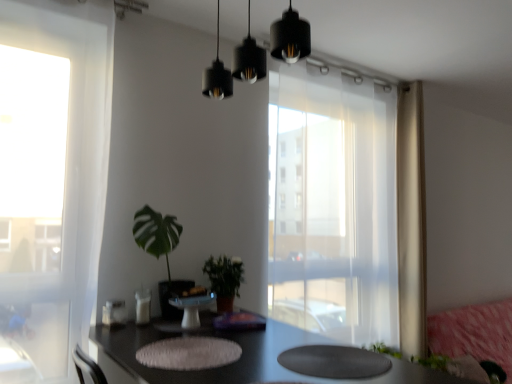
The height and width of the screenshot is (384, 512). Describe the element at coordinates (474, 333) in the screenshot. I see `pink fabric couch at lower right` at that location.

What do you see at coordinates (411, 220) in the screenshot? I see `beige sheer curtain at right` at bounding box center [411, 220].

What do you see at coordinates (333, 205) in the screenshot? The image size is (512, 384). I see `transparent curtain at center` at bounding box center [333, 205].

What do you see at coordinates (161, 252) in the screenshot?
I see `green leafy plant at center, positioned as the 1th houseplant in left-to-right order` at bounding box center [161, 252].

At what (x,y) coordinates should I click in order to perform the action: click on pink fabric couch at lower right. Please return your answer as a coordinate pair (x, y). Looking at the image, I should click on (474, 333).

Is pink fabric couch at lower right positioned with its back to transparent curtain at center?

No, pink fabric couch at lower right is not facing the opposite direction of transparent curtain at center.

Is point (458, 345) closer or farther from the camera than point (364, 277)?

Point (458, 345) is farther from the camera than point (364, 277).

From the image's perspective, is pink fabric couch at lower right located above transparent curtain at center?

No, from the image's perspective, pink fabric couch at lower right is not over transparent curtain at center.

Does green leafy plant at center, positioned as the second houseplant in right-to-left order, turn towards transparent curtain at center?

No, green leafy plant at center, positioned as the second houseplant in right-to-left order, is not oriented towards transparent curtain at center.

Is green leafy plant at center, positioned as the second houseplant in right-to-left order, to the left or to the right of transparent curtain at center in the image?

green leafy plant at center, positioned as the second houseplant in right-to-left order, is to the left of transparent curtain at center.

You are a GUI agent. You are given a task and a screenshot of the screen. Output one action in this format:
    pyautogui.click(x=<x>, y=<y>)
    Task: Click on the window behind the green leafy plant at center, positioned as the second houseplant in right-to-left order
    
    Given the screenshot: What is the action you would take?
    pyautogui.click(x=333, y=205)

Who is smaller, green leafy plant at center, positioned as the 1th houseplant in left-to-right order, or transparent curtain at center?

With smaller size is green leafy plant at center, positioned as the 1th houseplant in left-to-right order.

In the scene shown: Is green leafy plant at center, positioned as the 1th houseplant in left-to-right order, not close to black glossy table at center?

Actually, green leafy plant at center, positioned as the 1th houseplant in left-to-right order, and black glossy table at center are a little close together.

Where is `table to the right of green leafy plant at center, positioned as the 1th houseplant in left-to-right order`? table to the right of green leafy plant at center, positioned as the 1th houseplant in left-to-right order is located at coordinates (241, 356).

From the image's perspective, is green leafy plant at center, positioned as the 1th houseplant in left-to-right order, above or below black glossy table at center?

green leafy plant at center, positioned as the 1th houseplant in left-to-right order, is situated higher than black glossy table at center in the image.

Consider the image. Between green leafy plant at center, positioned as the second houseplant in right-to-left order, and black glossy table at center, which one appears on the left side from the viewer's perspective?

green leafy plant at center, positioned as the second houseplant in right-to-left order, is more to the left.

Between white glossy cake stand at center and green matte plant at center, the first houseplant viewed from the right, which one has less height?

white glossy cake stand at center.

Which is in front, white glossy cake stand at center or green matte plant at center, the first houseplant viewed from the right?

Positioned in front is white glossy cake stand at center.

From the image's perspective, would you say white glossy cake stand at center is shown under green matte plant at center, the first houseplant viewed from the right?

Correct, white glossy cake stand at center appears lower than green matte plant at center, the first houseplant viewed from the right, in the image.

From a real-world perspective, does white glossy cake stand at center stand above green matte plant at center, which is counted as the 2th houseplant, starting from the left?

Actually, white glossy cake stand at center is physically below green matte plant at center, which is counted as the 2th houseplant, starting from the left, in the real world.

Considering the positions of objects black glossy table at center and white glossy cake stand at center in the image provided, who is more to the left, black glossy table at center or white glossy cake stand at center?

From the viewer's perspective, white glossy cake stand at center appears more on the left side.

Is point (117, 338) closer or farther from the camera than point (203, 307)?

Point (117, 338) appears to be farther away from the viewer than point (203, 307).

Relative to white glossy cake stand at center, is black glossy table at center in front or behind?

black glossy table at center is positioned closer to the viewer than white glossy cake stand at center.

Who is smaller, black glossy table at center or white glossy cake stand at center?

Smaller between the two is white glossy cake stand at center.

Which object is positioned more to the right, black glossy table at center or green leafy plant at center, positioned as the 1th houseplant in left-to-right order?

Positioned to the right is black glossy table at center.

Which of these two, black glossy table at center or green leafy plant at center, positioned as the second houseplant in right-to-left order, stands taller?

With more height is green leafy plant at center, positioned as the second houseplant in right-to-left order.

From the black glossy table at center, count the 2nd houseplant to the left and point to it. Please provide its 2D coordinates.

[(161, 252)]

Which object is further away from the camera taking this photo, black glossy table at center or green leafy plant at center, positioned as the second houseplant in right-to-left order?

green leafy plant at center, positioned as the second houseplant in right-to-left order, is further from the camera.

Is white glossy cake stand at center oriented towards transparent curtain at center?

No, white glossy cake stand at center is not facing towards transparent curtain at center.

Is white glossy cake stand at center wider than transparent curtain at center?

Yes.

From the picture: Can you tell me how much white glossy cake stand at center and transparent curtain at center differ in facing direction?

90 degrees separate the facing orientations of white glossy cake stand at center and transparent curtain at center.

Locate an element on the screen. couch that is behind the transparent curtain at center is located at coordinates (474, 333).

Image resolution: width=512 pixels, height=384 pixels. I want to click on window above the green leafy plant at center, positioned as the 1th houseplant in left-to-right order (from a real-world perspective), so click(333, 205).

Looking at the image, which one is located further to green matte plant at center, which is counted as the 2th houseplant, starting from the left, transparent curtain at center or beige sheer curtain at right?

The object further to green matte plant at center, which is counted as the 2th houseplant, starting from the left, is beige sheer curtain at right.

Looking at the image, which one is located closer to green matte plant at center, which is counted as the 2th houseplant, starting from the left, transparent curtain at center or pink fabric couch at lower right?

transparent curtain at center is positioned closer to the anchor green matte plant at center, which is counted as the 2th houseplant, starting from the left.

Looking at the image, which one is located further to white glossy cake stand at center, black glossy table at center or black matte pendant lights at upper center?

black matte pendant lights at upper center lies further to white glossy cake stand at center than the other object.

Based on their spatial positions, is pink fabric couch at lower right or black matte pendant lights at upper center further from green matte plant at center, which is counted as the 2th houseplant, starting from the left?

Based on the image, pink fabric couch at lower right appears to be further to green matte plant at center, which is counted as the 2th houseplant, starting from the left.

Estimate the real-world distances between objects in this image. Which object is further from pink fabric couch at lower right, beige sheer curtain at right or transparent curtain at center?

transparent curtain at center is further to pink fabric couch at lower right.

Considering their positions, is pink fabric couch at lower right positioned closer to green matte plant at center, the first houseplant viewed from the right, than transparent curtain at center?

transparent curtain at center is closer to green matte plant at center, the first houseplant viewed from the right.

When comparing their distances from white glossy cake stand at center, does black matte pendant lights at upper center or black glossy table at center seem further?

black matte pendant lights at upper center is further to white glossy cake stand at center.

From the image, which object appears to be farther from white glossy cake stand at center, black matte pendant lights at upper center or green leafy plant at center, positioned as the 1th houseplant in left-to-right order?

The object further to white glossy cake stand at center is black matte pendant lights at upper center.

Locate an element on the screen. Image resolution: width=512 pixels, height=384 pixels. curtain located between black matte pendant lights at upper center and pink fabric couch at lower right in the left-right direction is located at coordinates (411, 220).

Image resolution: width=512 pixels, height=384 pixels. Identify the location of window between white glossy cake stand at center and pink fabric couch at lower right. (333, 205).

This screenshot has width=512, height=384. What are the coordinates of `round table between black glossy table at center and green matte plant at center, which is counted as the 2th houseplant, starting from the left, in the front-back direction` in the screenshot? It's located at (192, 309).

Where is `window between black matte pendant lights at upper center and pink fabric couch at lower right in the horizontal direction`? The width and height of the screenshot is (512, 384). window between black matte pendant lights at upper center and pink fabric couch at lower right in the horizontal direction is located at coordinates (333, 205).